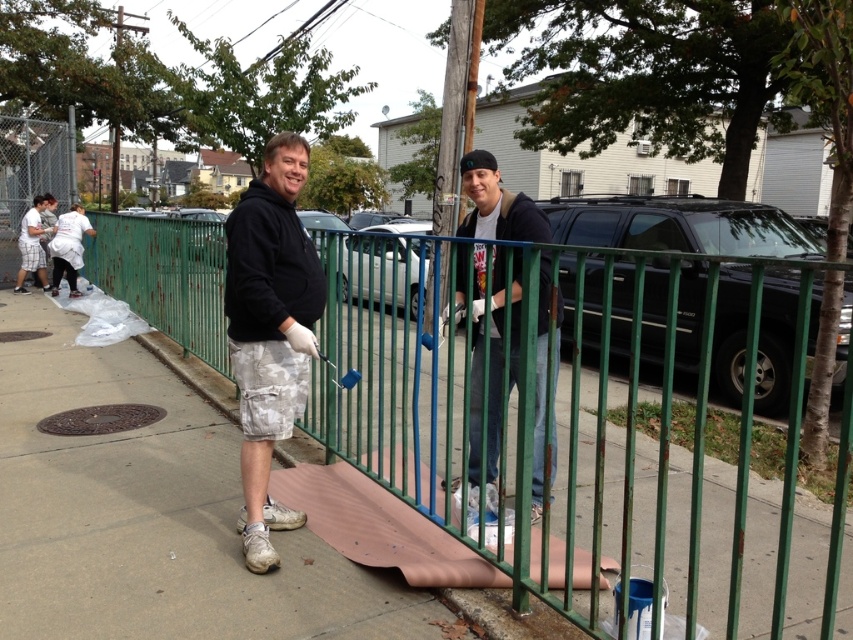
Is green painted metal fence at center taller than matte black hoodie at center?

Indeed, green painted metal fence at center has a greater height compared to matte black hoodie at center.

From the picture: Who is higher up, green painted metal fence at center or matte black hoodie at center?

green painted metal fence at center

Image resolution: width=853 pixels, height=640 pixels. Identify the location of green painted metal fence at center. (693, 531).

Can you confirm if green painted metal fence at center is positioned above black matte hoodie at center?

Yes, green painted metal fence at center is above black matte hoodie at center.

Who is more distant from viewer, (793, 588) or (289, 528)?

The point (289, 528) is behind.

Where is `green painted metal fence at center`? This screenshot has height=640, width=853. green painted metal fence at center is located at coordinates (693, 531).

Is brown paper at center shorter than black matte hoodie at center?

Yes.

The height and width of the screenshot is (640, 853). I want to click on brown paper at center, so click(154, 515).

Image resolution: width=853 pixels, height=640 pixels. In order to click on brown paper at center in this screenshot , I will do `click(154, 515)`.